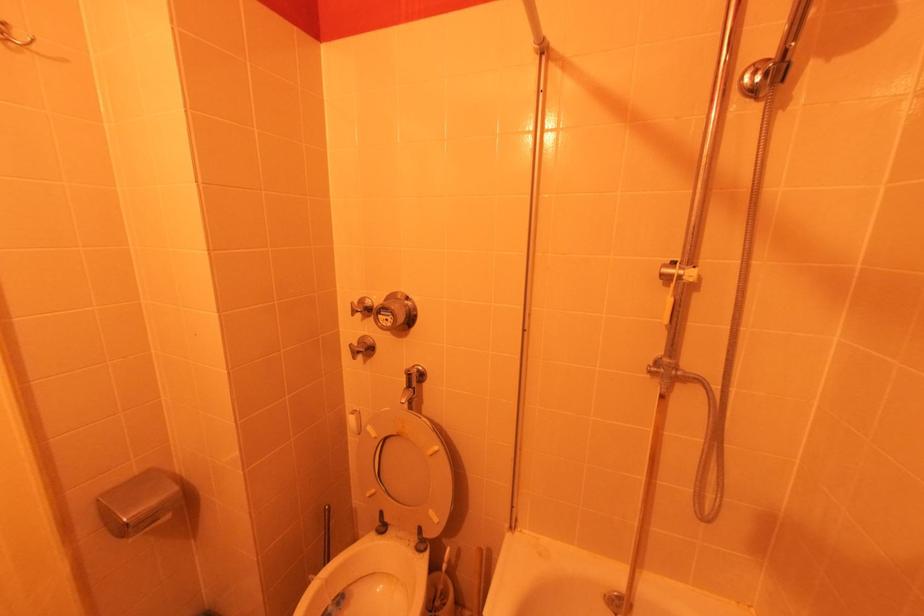
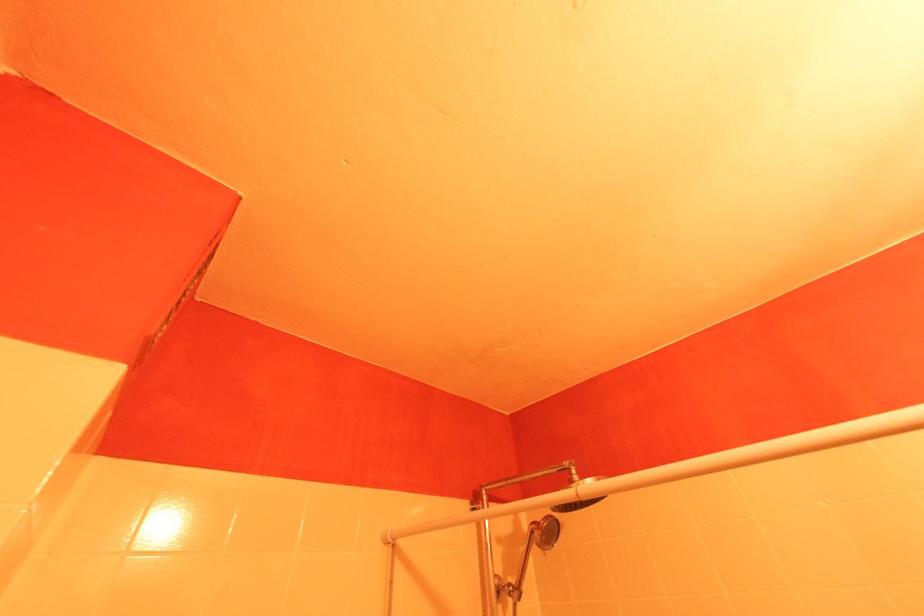
How did the camera likely rotate?

The camera rotated toward right-up.